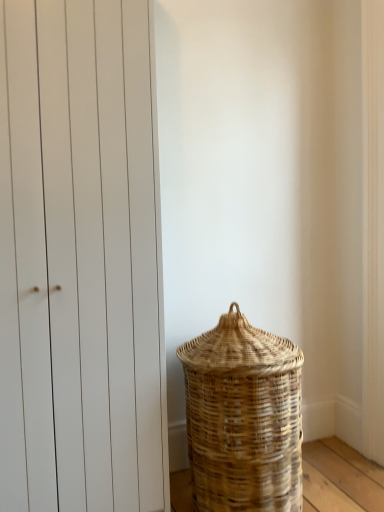
Question: Considering the relative sizes of natural woven basket at lower right and white matte door at left in the image provided, is natural woven basket at lower right shorter than white matte door at left?

Choices:
 (A) yes
 (B) no

Answer: (A)

Question: From the image's perspective, is natural woven basket at lower right located above white matte door at left?

Choices:
 (A) yes
 (B) no

Answer: (B)

Question: Considering the relative sizes of natural woven basket at lower right and white matte door at left in the image provided, is natural woven basket at lower right bigger than white matte door at left?

Choices:
 (A) yes
 (B) no

Answer: (B)

Question: Is natural woven basket at lower right far away from white matte door at left?

Choices:
 (A) no
 (B) yes

Answer: (A)

Question: Considering the relative sizes of natural woven basket at lower right and white matte door at left in the image provided, is natural woven basket at lower right thinner than white matte door at left?

Choices:
 (A) yes
 (B) no

Answer: (B)

Question: Considering the relative sizes of natural woven basket at lower right and white matte door at left in the image provided, is natural woven basket at lower right smaller than white matte door at left?

Choices:
 (A) yes
 (B) no

Answer: (A)

Question: From a real-world perspective, does white matte door at left stand above natural woven basket at lower right?

Choices:
 (A) yes
 (B) no

Answer: (A)

Question: Is natural woven basket at lower right surrounded by white matte door at left?

Choices:
 (A) no
 (B) yes

Answer: (A)

Question: Can you confirm if white matte door at left is taller than natural woven basket at lower right?

Choices:
 (A) no
 (B) yes

Answer: (B)

Question: From the image's perspective, is white matte door at left on top of natural woven basket at lower right?

Choices:
 (A) no
 (B) yes

Answer: (B)

Question: Are white matte door at left and natural woven basket at lower right beside each other?

Choices:
 (A) yes
 (B) no

Answer: (B)

Question: Are white matte door at left and natural woven basket at lower right far apart?

Choices:
 (A) yes
 (B) no

Answer: (B)

Question: Is white matte door at left situated inside natural woven basket at lower right or outside?

Choices:
 (A) outside
 (B) inside

Answer: (A)